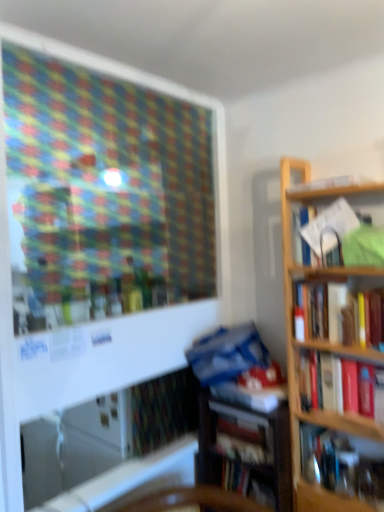
Question: Is white paper at upper right, which is counted as the 6th book, starting from the bottom, inside the boundaries of hardcover book at upper right, which appears as the seventh book when ordered from the bottom, or outside?

Choices:
 (A) outside
 (B) inside

Answer: (A)

Question: From the image's perspective, is white paper at upper right, the 2th book viewed from the top, above or below hardcover book at upper right, which appears as the 1th book when viewed from the top?

Choices:
 (A) above
 (B) below

Answer: (B)

Question: Considering the real-world distances, which object is farthest from the hardcover book at lower center, the first book in the bottom-to-top sequence?

Choices:
 (A) hardcover book at right, positioned as the fourth book in top-to-bottom order
 (B) blue matte book at center, which is the 5th book from top to bottom
 (C) hardcover book at lower center, marked as the second book in a bottom-to-top arrangement
 (D) white paper at upper right, which is counted as the 6th book, starting from the bottom
 (E) hardcover book at upper right, which appears as the seventh book when ordered from the bottom

Answer: (E)

Question: Considering the real-world distances, which object is farthest from the hardcover book at lower center, which ranks as the 6th book in top-to-bottom order?

Choices:
 (A) hardcover book at right, which is counted as the 5th book, starting from the bottom
 (B) hardcover book at right, positioned as the fourth book in top-to-bottom order
 (C) hardcover book at upper right, which appears as the seventh book when ordered from the bottom
 (D) hardcover book at lower center, the seventh book when ordered from top to bottom
 (E) white paper at upper right, the 2th book viewed from the top

Answer: (C)